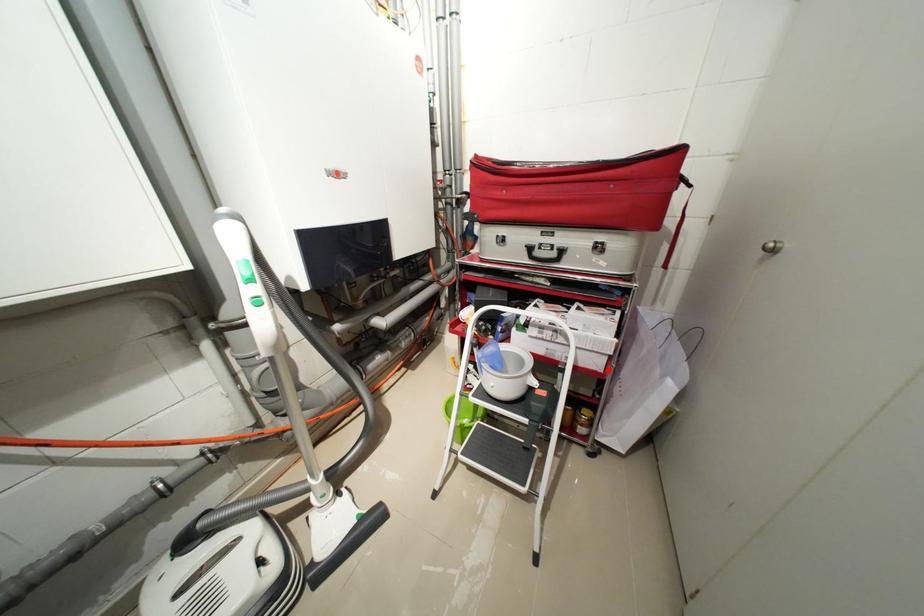
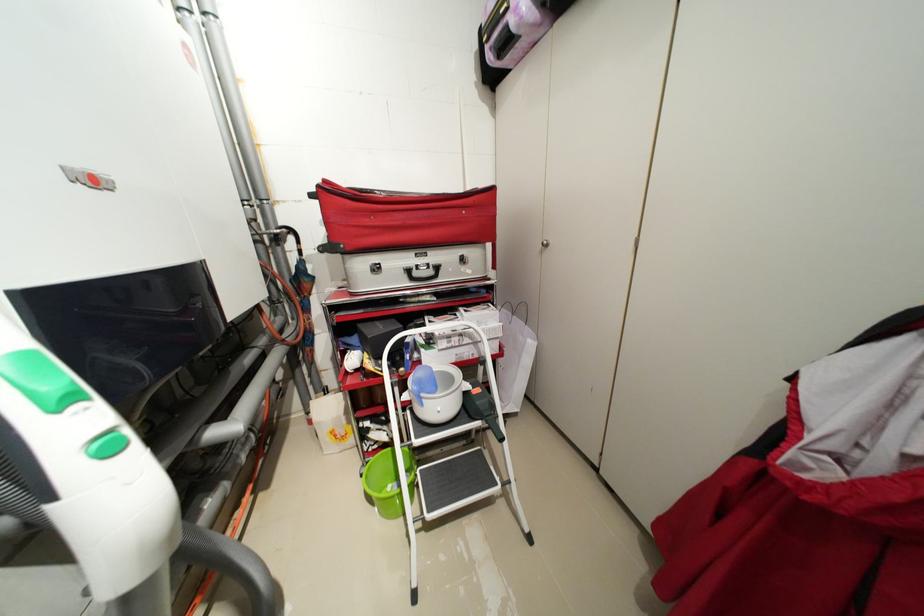
The point at the highlighted location is marked in the first image. Where is the corresponding point in the second image?

(505, 352)